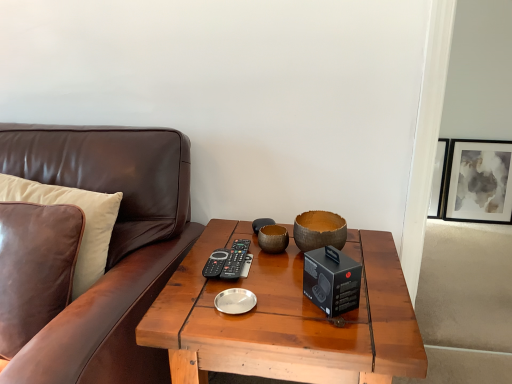
The height and width of the screenshot is (384, 512). What are the coordinates of `free space to the left of natural wood bowl at center` in the screenshot? It's located at (261, 263).